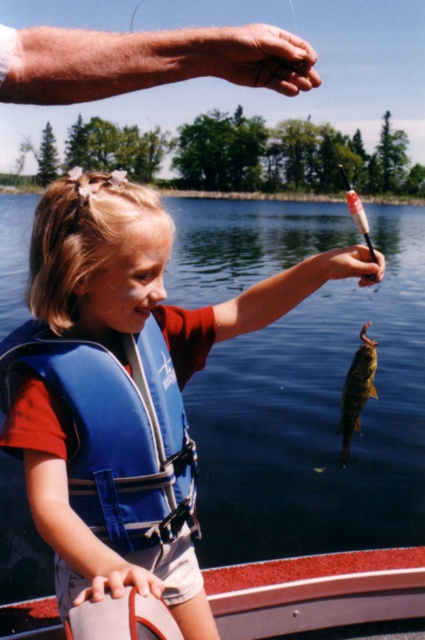
You are a photographer trying to capture a candid shot of the girl and the fish she caught. You want to ensure both the blue fabric life jacket at left and the shiny golden fish at lower right are visible in the frame. Based on their positions, which object should you focus on first to include both in your shot?

The blue fabric life jacket at left is below the shiny golden fish at lower right, so you should focus on the shiny golden fish at lower right first to ensure both are in the frame.